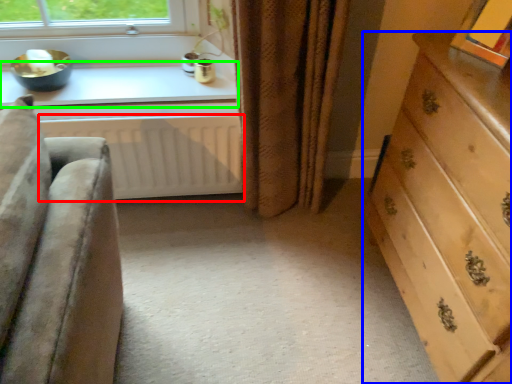
Question: Based on their relative distances, which object is farther from radiator (highlighted by a red box)? Choose from chest of drawers (highlighted by a blue box) and window sill (highlighted by a green box).

Choices:
 (A) chest of drawers
 (B) window sill

Answer: (A)